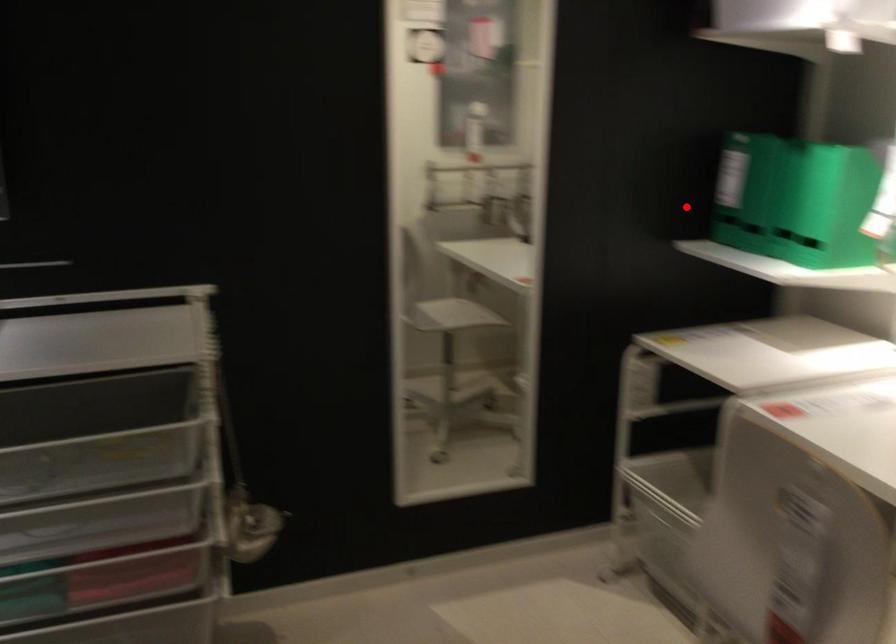
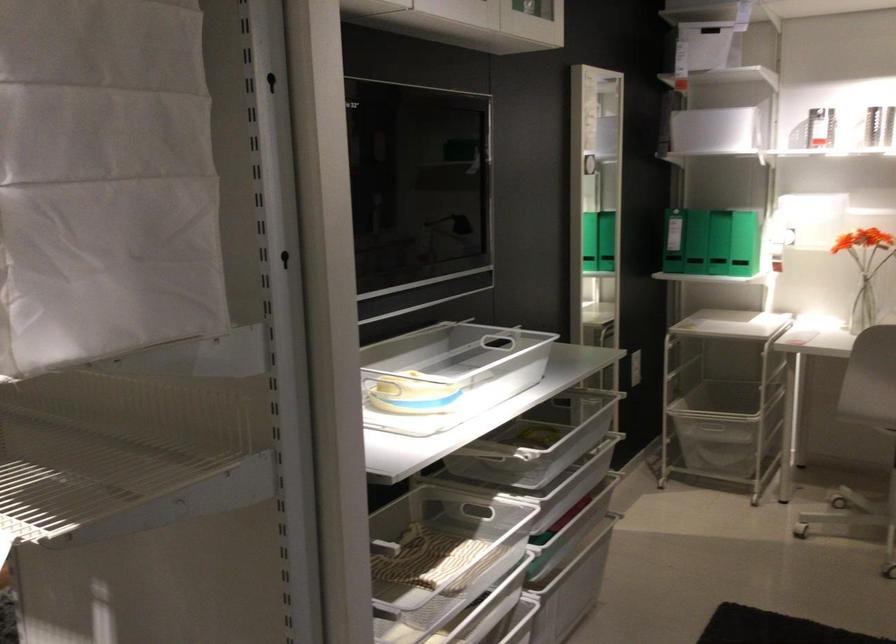
The point at the highlighted location is marked in the first image. Where is the corresponding point in the second image?

(673, 241)